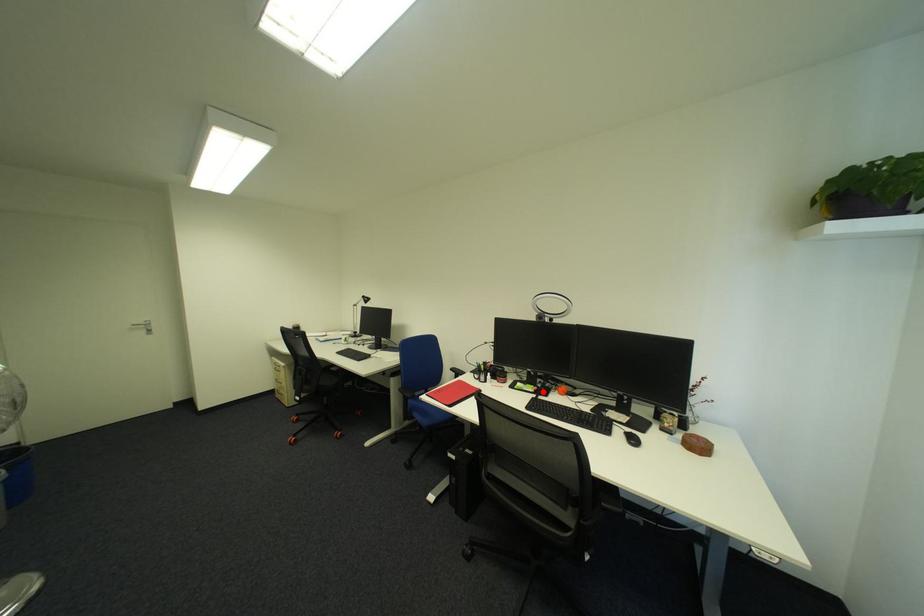
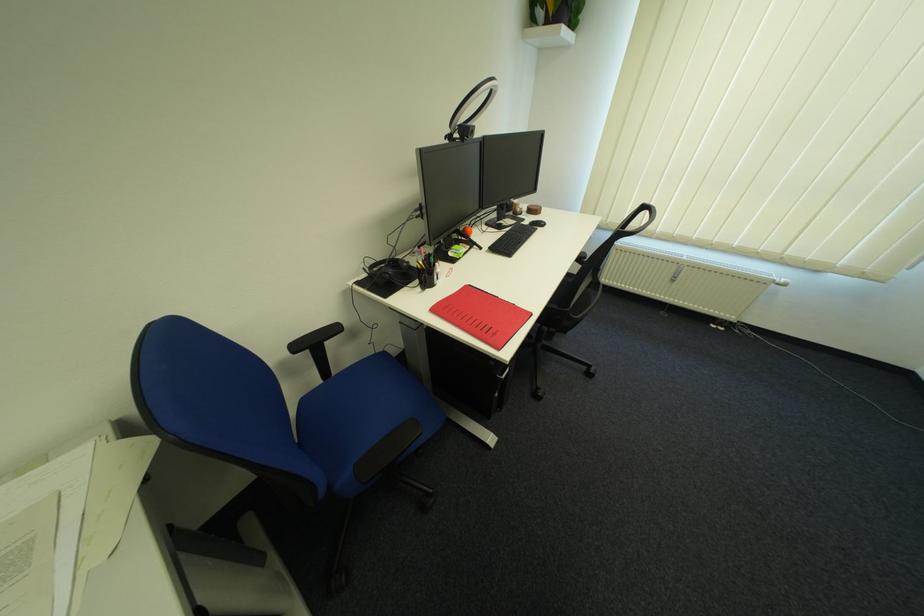
Question: I am providing you with two images of the same scene from different viewpoints. Given a red point in image1, look at the same physical point in image2. Is it:

Choices:
 (A) Closer to the viewpoint
 (B) Farther from the viewpoint

Answer: (A)